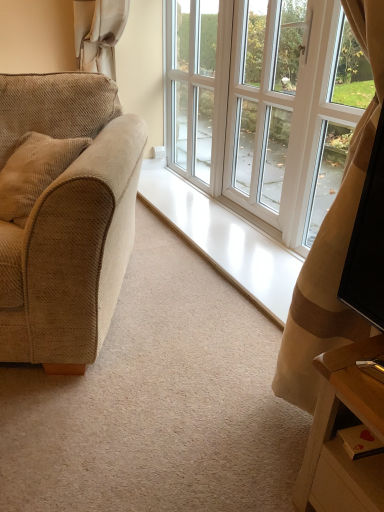
Question: Is point (198, 66) closer or farther from the camera than point (86, 310)?

Choices:
 (A) closer
 (B) farther

Answer: (B)

Question: From their relative heights in the image, would you say white glass screen door at upper center, the first screen door in the left-to-right sequence, is taller or shorter than beige corduroy couch at left?

Choices:
 (A) tall
 (B) short

Answer: (A)

Question: Considering the real-world distances, which object is closest to the white glass window at center?

Choices:
 (A) white glossy screen door at center, acting as the 1th screen door starting from the right
 (B) white glass screen door at upper center, the first screen door in the left-to-right sequence
 (C) beige corduroy couch at left

Answer: (A)

Question: Which of these objects is positioned farthest from the white glossy screen door at center, which is the 2th screen door from left to right?

Choices:
 (A) white glass window at center
 (B) white glass screen door at upper center, acting as the second screen door starting from the right
 (C) beige corduroy couch at left

Answer: (C)